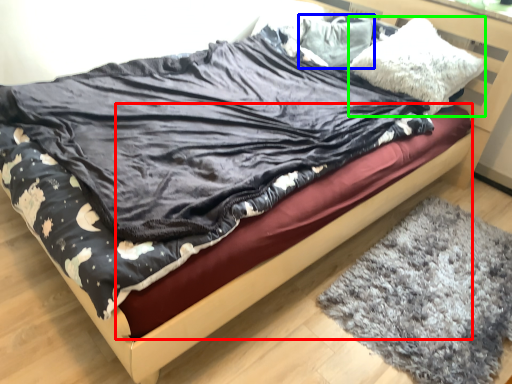
Question: Based on their relative distances, which object is nearer to bed frame (highlighted by a red box)? Choose from pillow (highlighted by a blue box) and pillow (highlighted by a green box).

Choices:
 (A) pillow
 (B) pillow

Answer: (B)